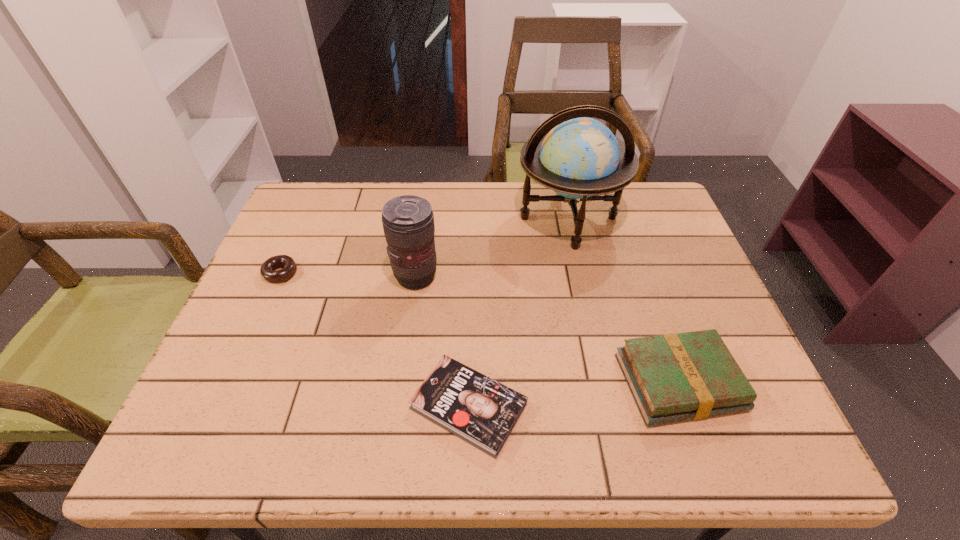
What are the coordinates of `the farthest object` in the screenshot? It's located at (579, 158).

Find the location of a particular element. The height and width of the screenshot is (540, 960). globe is located at coordinates (579, 158).

The image size is (960, 540). In order to click on the fourth shortest object in this screenshot , I will do `click(408, 221)`.

I want to click on the taller book, so click(675, 377).

Identify the location of the third shortest object. (675, 377).

Identify the location of the leftmost object. This screenshot has width=960, height=540. (289, 266).

Where is `the shorter book`? The height and width of the screenshot is (540, 960). the shorter book is located at coordinates (483, 412).

Identify the location of the left book. The image size is (960, 540). (483, 412).

You are a GUI agent. You are given a task and a screenshot of the screen. Output one action in this format:
    pyautogui.click(x=<x>, y=<y>)
    Task: Click on the free spot located on the surface of the farthest object
    This screenshot has width=960, height=540.
    Given the screenshot: What is the action you would take?
    pyautogui.click(x=603, y=373)

I want to click on vacant area situated on the side of the telephoto lens where the control switches are located, so [x=557, y=276].